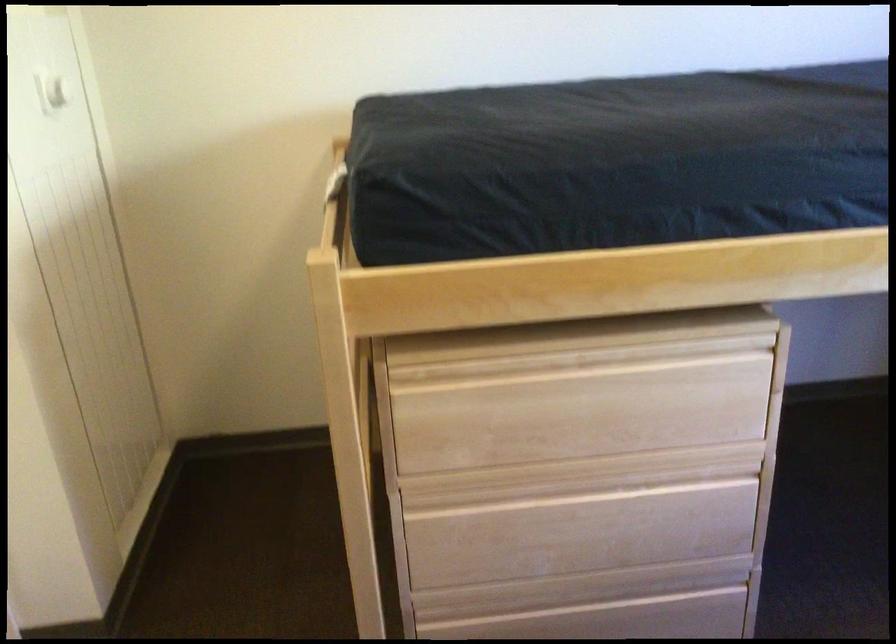
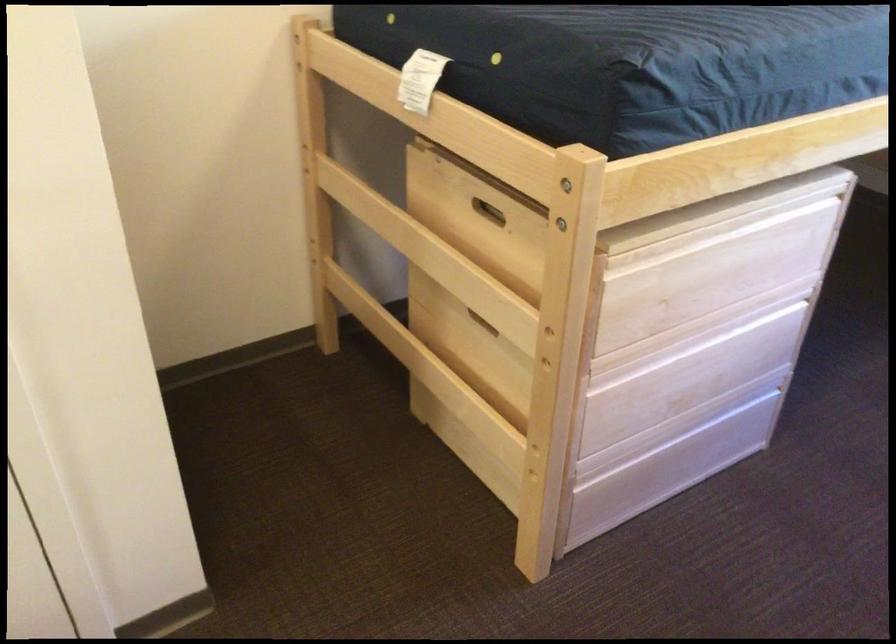
Question: The camera is either moving clockwise (left) or counter-clockwise (right) around the object. The first image is from the beginning of the video and the second image is from the end. Is the camera moving left or right when shooting the video?

Choices:
 (A) Left
 (B) Right

Answer: (A)